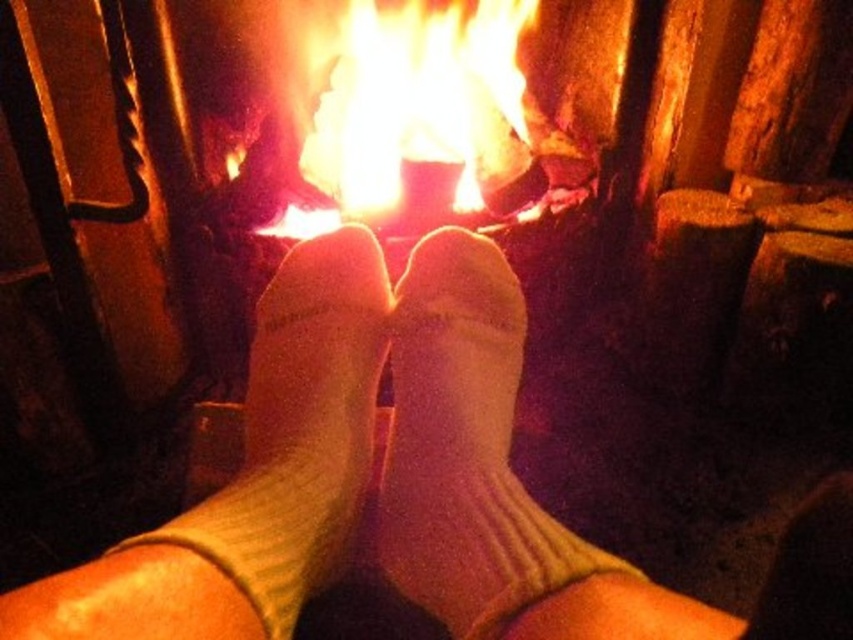
Can you confirm if white ribbed socks at center is bigger than white ribbed sock at center?

Indeed, white ribbed socks at center has a larger size compared to white ribbed sock at center.

Who is more forward, (428, 420) or (260, 612)?

Point (260, 612) is in front.

Who is more forward, (x=296, y=291) or (x=281, y=282)?

Point (x=296, y=291)

Where is `white ribbed socks at center`? The width and height of the screenshot is (853, 640). white ribbed socks at center is located at coordinates (405, 484).

Which is behind, point (494, 400) or point (358, 392)?

Positioned behind is point (358, 392).

Is point (410, 566) positioned in front of point (277, 316)?

Yes, it is in front of point (277, 316).

Image resolution: width=853 pixels, height=640 pixels. I want to click on white knit socks at center, so click(x=463, y=445).

Image resolution: width=853 pixels, height=640 pixels. Describe the element at coordinates (405, 484) in the screenshot. I see `white ribbed socks at center` at that location.

Who is more forward, [833,605] or [439,292]?

Point [833,605]

Which is in front, point (71, 595) or point (498, 269)?

Point (71, 595) is more forward.

I want to click on white ribbed socks at center, so click(405, 484).